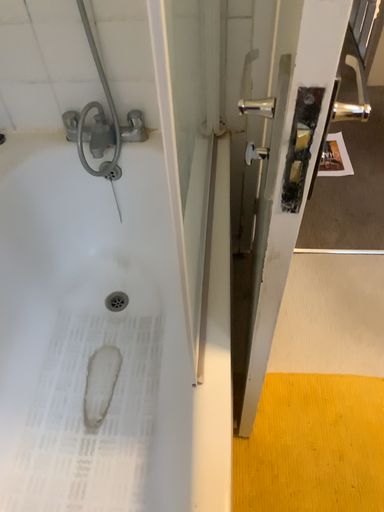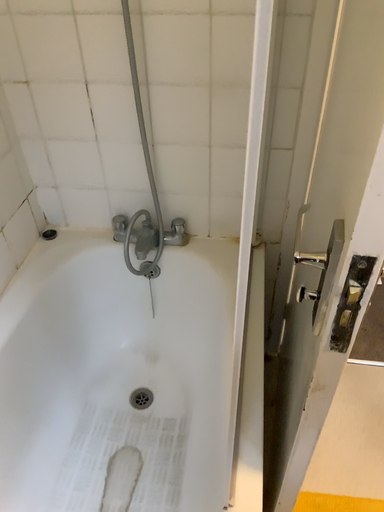
Question: Which way did the camera rotate in the video?

Choices:
 (A) rotated upward
 (B) rotated downward

Answer: (A)